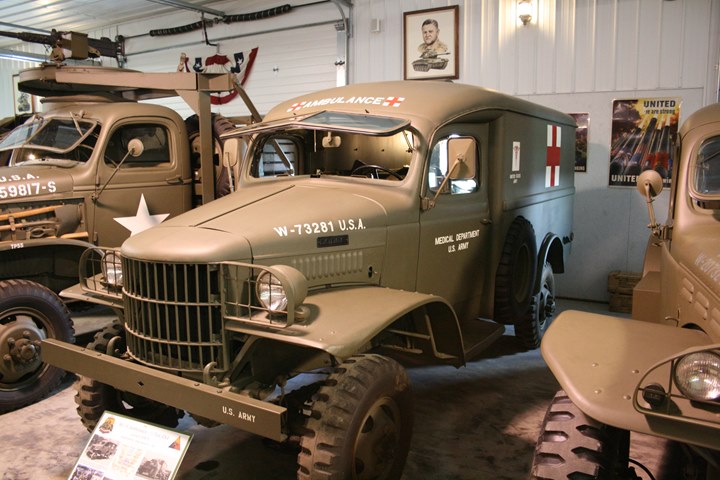
Locate an element on the screen. posters is located at coordinates (641, 133), (582, 130).